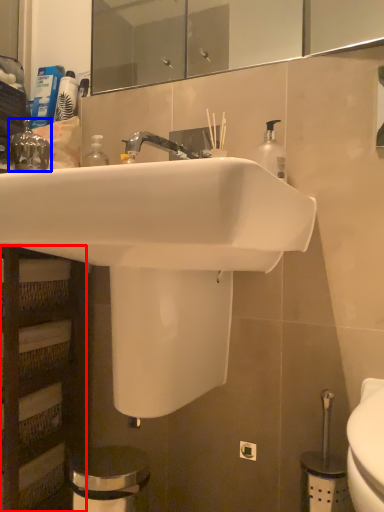
Question: Which object is further to the camera taking this photo, shelf (highlighted by a red box) or plumbing fixture (highlighted by a blue box)?

Choices:
 (A) shelf
 (B) plumbing fixture

Answer: (B)